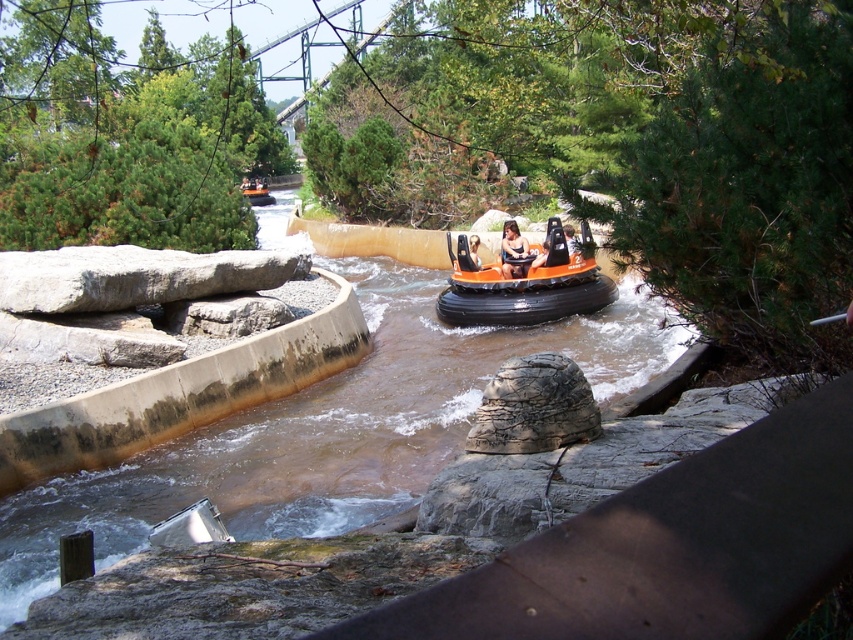
Question: Which point appears closest to the camera in this image?

Choices:
 (A) (479, 241)
 (B) (518, 252)

Answer: (A)

Question: Is orange matte bumper boat at center closer to the viewer compared to smooth orange raft at center?

Choices:
 (A) yes
 (B) no

Answer: (A)

Question: Does matte orange raft at center appear under smooth orange raft at center?

Choices:
 (A) yes
 (B) no

Answer: (B)

Question: Does orange matte bumper boat at center have a larger size compared to matte orange raft at center?

Choices:
 (A) no
 (B) yes

Answer: (A)

Question: Which point is closer to the camera?

Choices:
 (A) (523, 308)
 (B) (519, 273)
 (C) (476, 252)

Answer: (A)

Question: Which object appears farthest from the camera in this image?

Choices:
 (A) matte orange raft at center
 (B) orange matte bumper boat at center
 (C) smooth orange raft at center

Answer: (C)